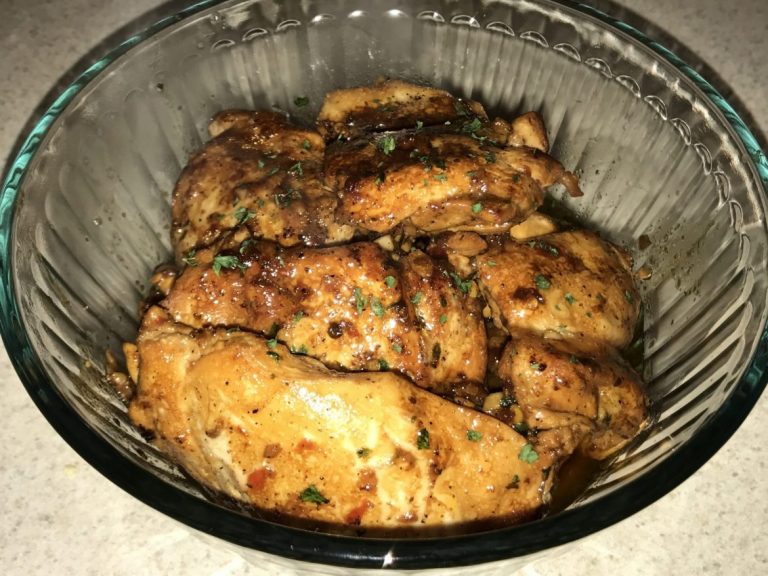
At what (x,y) coordinates should I click in order to perform the action: click on countertop. Please return your answer as a coordinate pair (x, y). Looking at the image, I should click on (83, 534), (699, 522), (730, 48), (48, 37), (131, 207), (627, 170), (683, 314), (481, 58), (286, 71).